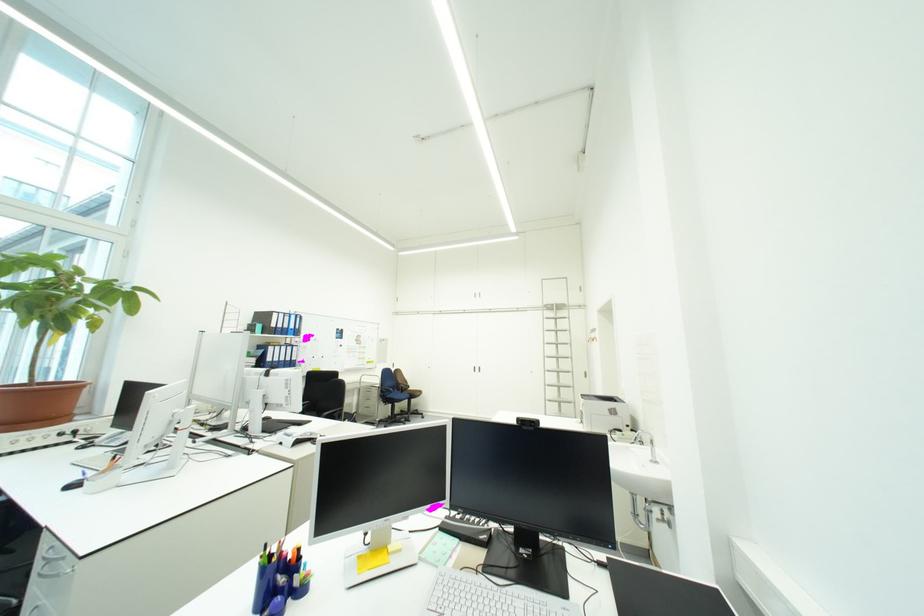
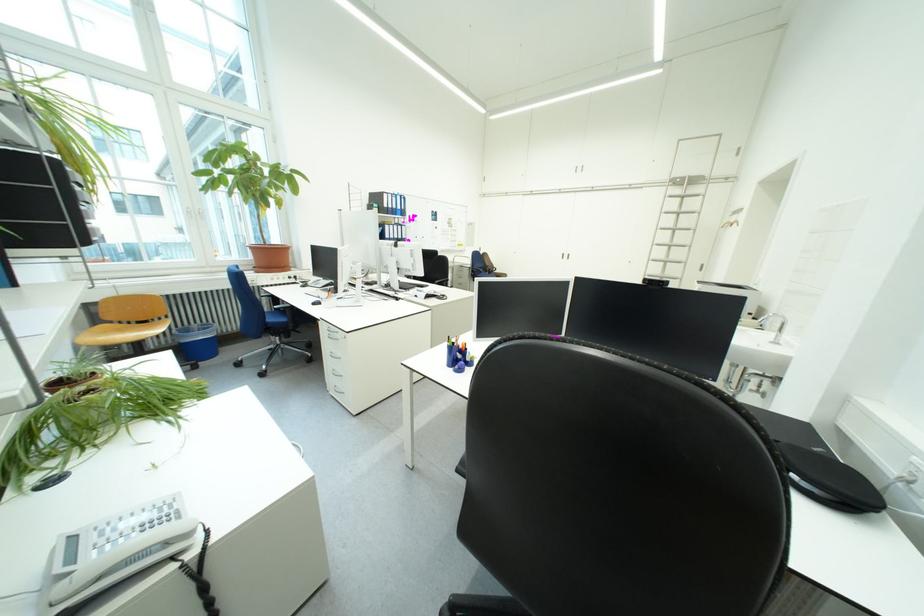
The point at [488,371] is marked in the first image. Where is the corresponding point in the second image?

(577, 257)